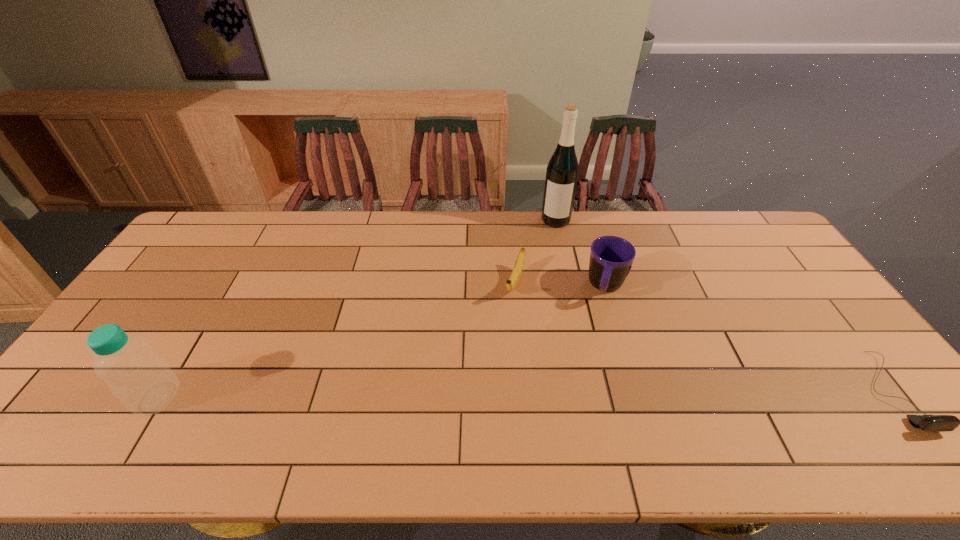
Where is `free spot between the rightmost object and the third tallest object`? Image resolution: width=960 pixels, height=540 pixels. free spot between the rightmost object and the third tallest object is located at coordinates (749, 339).

Identify the location of free space between the tallest object and the third tallest object. (581, 253).

Where is `unoccupied area between the webcam and the leftmost object`? This screenshot has width=960, height=540. unoccupied area between the webcam and the leftmost object is located at coordinates (524, 394).

Image resolution: width=960 pixels, height=540 pixels. Find the location of `unoccupied area between the mug and the wine bottle`. unoccupied area between the mug and the wine bottle is located at coordinates coord(581,253).

The image size is (960, 540). I want to click on empty space between the second object from left to right and the shortest object, so click(x=704, y=337).

The image size is (960, 540). I want to click on blank region between the leftmost object and the rightmost object, so click(x=524, y=394).

At what (x,y) coordinates should I click in order to perform the action: click on vacant area between the leftmost object and the mug. Please return your answer as a coordinate pair (x, y). Looking at the image, I should click on (382, 342).

This screenshot has height=540, width=960. I want to click on vacant region between the leftmost object and the fourth tallest object, so click(336, 340).

What are the coordinates of `free point between the second tallest object and the farthest object` in the screenshot? It's located at (357, 308).

Find the location of a particular element. the third closest object to the leftmost object is located at coordinates (562, 171).